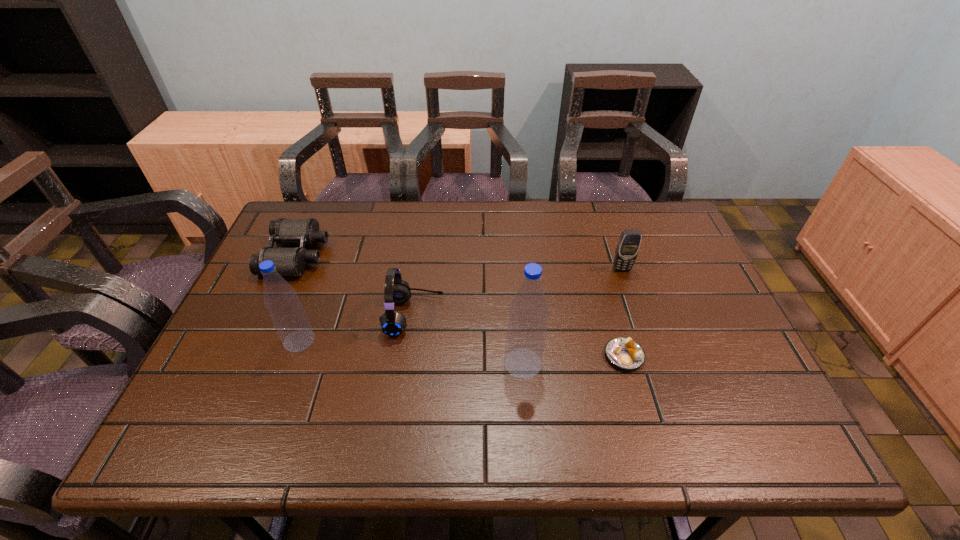
The image size is (960, 540). In order to click on free region at the near edge in this screenshot , I will do `click(345, 400)`.

Where is `free space at the left edge of the desktop`? Image resolution: width=960 pixels, height=540 pixels. free space at the left edge of the desktop is located at coordinates (260, 287).

I want to click on vacant area at the near left corner of the desktop, so click(x=263, y=379).

This screenshot has height=540, width=960. I want to click on vacant region at the far right corner of the desktop, so click(x=643, y=246).

Identify the location of vacant region between the cellular telephone and the binoculars. This screenshot has width=960, height=540. (459, 262).

The image size is (960, 540). Find the location of `vacant area between the shorter water bottle and the fourth object from right to left`. vacant area between the shorter water bottle and the fourth object from right to left is located at coordinates (357, 328).

Where is `vacant space in between the fifth shortest object and the taller water bottle`? vacant space in between the fifth shortest object and the taller water bottle is located at coordinates (411, 352).

Identify the location of empty space between the cellular telephone and the left water bottle. (461, 305).

Image resolution: width=960 pixels, height=540 pixels. Find the location of `vacant region between the pastry and the shorter water bottle`. vacant region between the pastry and the shorter water bottle is located at coordinates (462, 348).

Find the location of a particular element. free point between the shortest object and the second tallest object is located at coordinates (462, 348).